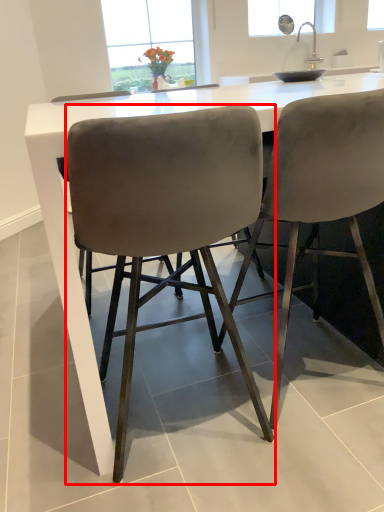
Question: From the image's perspective, what is the correct spatial positioning of chair (annotated by the red box) in reference to chair?

Choices:
 (A) above
 (B) below

Answer: (B)